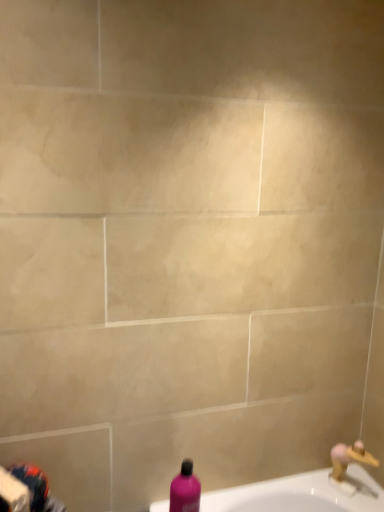
Question: Can we say gold metallic faucet at lower right lies outside pink matte bottle at lower center?

Choices:
 (A) no
 (B) yes

Answer: (B)

Question: From the image's perspective, is gold metallic faucet at lower right over pink matte bottle at lower center?

Choices:
 (A) yes
 (B) no

Answer: (B)

Question: Can you confirm if gold metallic faucet at lower right is taller than pink matte bottle at lower center?

Choices:
 (A) yes
 (B) no

Answer: (B)

Question: Are gold metallic faucet at lower right and pink matte bottle at lower center beside each other?

Choices:
 (A) no
 (B) yes

Answer: (A)

Question: From a real-world perspective, is gold metallic faucet at lower right physically above pink matte bottle at lower center?

Choices:
 (A) no
 (B) yes

Answer: (A)

Question: Does gold metallic faucet at lower right appear on the left side of pink matte bottle at lower center?

Choices:
 (A) yes
 (B) no

Answer: (B)

Question: Is gold metallic faucet at lower right completely or partially inside pink matte bottle at lower center?

Choices:
 (A) no
 (B) yes

Answer: (A)

Question: Does pink matte bottle at lower center appear on the right side of gold metallic faucet at lower right?

Choices:
 (A) yes
 (B) no

Answer: (B)

Question: From the image's perspective, does pink matte bottle at lower center appear lower than gold metallic faucet at lower right?

Choices:
 (A) no
 (B) yes

Answer: (A)

Question: Is pink matte bottle at lower center with gold metallic faucet at lower right?

Choices:
 (A) no
 (B) yes

Answer: (A)

Question: Is pink matte bottle at lower center not near gold metallic faucet at lower right?

Choices:
 (A) yes
 (B) no

Answer: (B)

Question: From a real-world perspective, is pink matte bottle at lower center over gold metallic faucet at lower right?

Choices:
 (A) no
 (B) yes

Answer: (B)

Question: Looking at the image, does pink matte bottle at lower center seem bigger or smaller compared to gold metallic faucet at lower right?

Choices:
 (A) small
 (B) big

Answer: (B)